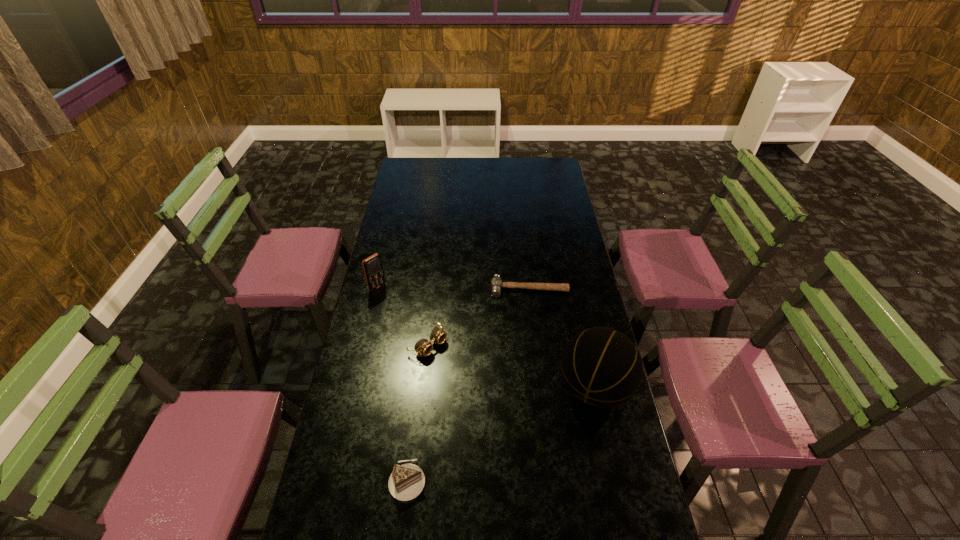
Find the location of `vacant space that satisfies the following two spatial constraints: 1. on the back side of the goggles; 2. on the right side of the hammer`. vacant space that satisfies the following two spatial constraints: 1. on the back side of the goggles; 2. on the right side of the hammer is located at coordinates (434, 288).

I want to click on vacant area that satisfies the following two spatial constraints: 1. on the back side of the shortest object; 2. on the right side of the goggles, so click(x=434, y=288).

Locate an element on the screen. blank area in the image that satisfies the following two spatial constraints: 1. on the front side of the nearest object; 2. on the right side of the leftmost object is located at coordinates (332, 481).

You are a GUI agent. You are given a task and a screenshot of the screen. Output one action in this format:
    pyautogui.click(x=<x>, y=<y>)
    Task: Click on the free space that satisfies the following two spatial constraints: 1. on the back side of the chocolate cake; 2. on the left side of the goggles
    Image resolution: width=960 pixels, height=540 pixels.
    Given the screenshot: What is the action you would take?
    pyautogui.click(x=423, y=344)

What are the coordinates of `free region that satisfies the following two spatial constraints: 1. on the back side of the hammer; 2. on the right side of the goggles` in the screenshot? It's located at (434, 288).

Locate an element on the screen. The height and width of the screenshot is (540, 960). free location that satisfies the following two spatial constraints: 1. on the back side of the hammer; 2. on the right side of the goggles is located at coordinates (434, 288).